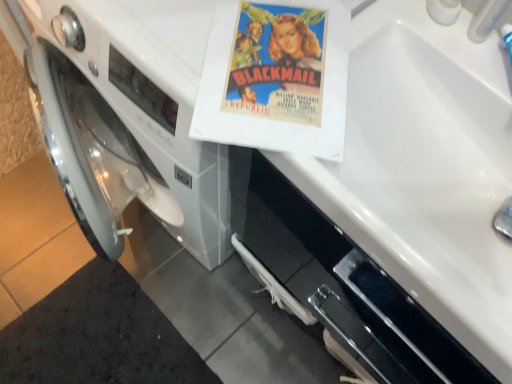
At what (x,y) coordinates should I click in order to perform the action: click on matte paper poster at center. Please return your answer as a coordinate pair (x, y). Looking at the image, I should click on (276, 77).

In order to face white plastic faucet at upper right, should I rotate leftwards or rightwards?

You should look right and rotate roughly 32.660 degrees.

The image size is (512, 384). What do you see at coordinates (400, 206) in the screenshot? I see `white glossy sink at upper right` at bounding box center [400, 206].

At what (x,y) coordinates should I click in order to perform the action: click on matte paper poster at center. Please return your answer as a coordinate pair (x, y). This screenshot has width=512, height=384. Looking at the image, I should click on (276, 77).

From the picture: Between matte paper poster at center and white glossy sink at upper right, which one appears on the left side from the viewer's perspective?

From the viewer's perspective, matte paper poster at center appears more on the left side.

Does matte paper poster at center have a greater height compared to white glossy sink at upper right?

Incorrect, the height of matte paper poster at center is not larger of that of white glossy sink at upper right.

Based on the photo, could you tell me if white plastic faucet at upper right is turned towards matte paper poster at center?

No, white plastic faucet at upper right is not oriented towards matte paper poster at center.

Is the position of white plastic faucet at upper right less distant than that of matte paper poster at center?

Yes, white plastic faucet at upper right is in front of matte paper poster at center.

Is white plastic faucet at upper right with matte paper poster at center?

white plastic faucet at upper right is not next to matte paper poster at center, and they're not touching.

Consider the image. From a real-world perspective, is white plastic faucet at upper right physically below matte paper poster at center?

Incorrect, from a real-world perspective, white plastic faucet at upper right is higher than matte paper poster at center.

Would you say white glossy sink at upper right is to the left or to the right of matte paper poster at center in the picture?

In the image, white glossy sink at upper right appears on the right side of matte paper poster at center.

From the image's perspective, is white glossy sink at upper right on matte paper poster at center?

No, from the image's perspective, white glossy sink at upper right is not on top of matte paper poster at center.

Is point (399, 69) closer or farther from the camera than point (255, 139)?

Point (399, 69) is farther from the camera than point (255, 139).

Which point is more distant from viewer, (485, 12) or (408, 271)?

The point (485, 12) is farther.

Does white plastic faucet at upper right have a greater height compared to white glossy sink at upper right?

Indeed, white plastic faucet at upper right has a greater height compared to white glossy sink at upper right.

Is white plastic faucet at upper right inside the boundaries of white glossy sink at upper right, or outside?

white plastic faucet at upper right lies outside white glossy sink at upper right.

Would you say white glossy sink at upper right is a long distance from white plastic faucet at upper right?

No, there isn't a large distance between white glossy sink at upper right and white plastic faucet at upper right.

Based on the photo, could you tell me if white glossy sink at upper right is turned towards white plastic faucet at upper right?

No, white glossy sink at upper right is not aimed at white plastic faucet at upper right.

From a real-world perspective, which object stands above the other?

white plastic faucet at upper right.

In terms of width, does white glossy sink at upper right look wider or thinner when compared to white plastic faucet at upper right?

In the image, white glossy sink at upper right appears to be wider than white plastic faucet at upper right.

Visually, is matte paper poster at center positioned to the left or to the right of white plastic faucet at upper right?

Clearly, matte paper poster at center is on the left of white plastic faucet at upper right in the image.

Which is more distant, (257, 121) or (498, 15)?

Positioned behind is point (498, 15).

Is matte paper poster at center oriented away from white plastic faucet at upper right?

No.

Locate an element on the screen. This screenshot has width=512, height=384. sink in front of the matte paper poster at center is located at coordinates (400, 206).

Locate an element on the screen. The width and height of the screenshot is (512, 384). paperback book located below the white plastic faucet at upper right (from the image's perspective) is located at coordinates (276, 77).

When comparing their distances from white glossy sink at upper right, does matte paper poster at center or white plastic faucet at upper right seem closer?

The object closer to white glossy sink at upper right is matte paper poster at center.

Looking at the image, which one is located closer to white plastic faucet at upper right, white glossy sink at upper right or matte paper poster at center?

matte paper poster at center lies closer to white plastic faucet at upper right than the other object.

When comparing their distances from matte paper poster at center, does white glossy sink at upper right or white plastic faucet at upper right seem closer?

white plastic faucet at upper right lies closer to matte paper poster at center than the other object.

From the image, which object appears to be nearer to white glossy sink at upper right, white plastic faucet at upper right or matte paper poster at center?

The object closer to white glossy sink at upper right is matte paper poster at center.

From the image, which object appears to be nearer to white plastic faucet at upper right, matte paper poster at center or white glossy sink at upper right?

matte paper poster at center lies closer to white plastic faucet at upper right than the other object.

Which object lies nearer to the anchor point matte paper poster at center, white plastic faucet at upper right or white glossy sink at upper right?

The object closer to matte paper poster at center is white plastic faucet at upper right.

Where is `sink between matte paper poster at center and white plastic faucet at upper right in the horizontal direction`? sink between matte paper poster at center and white plastic faucet at upper right in the horizontal direction is located at coordinates (400, 206).